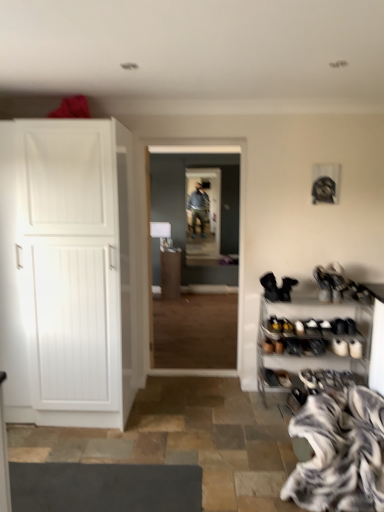
Question: Should I look upward or downward to see white matte cabinet at left?

Choices:
 (A) down
 (B) up

Answer: (A)

Question: From a real-world perspective, is black suede boot at right, the 1th footwear from the right, positioned over wooden floor at center based on gravity?

Choices:
 (A) yes
 (B) no

Answer: (B)

Question: Is black suede boot at right, the second footwear in the left-to-right sequence, smaller than wooden floor at center?

Choices:
 (A) yes
 (B) no

Answer: (A)

Question: Is black suede boot at right, the second footwear in the left-to-right sequence, oriented towards wooden floor at center?

Choices:
 (A) yes
 (B) no

Answer: (B)

Question: Does black suede boot at right, the 1th footwear from the right, come in front of wooden floor at center?

Choices:
 (A) no
 (B) yes

Answer: (B)

Question: Can you confirm if black suede boot at right, the second footwear in the left-to-right sequence, is positioned to the right of wooden floor at center?

Choices:
 (A) no
 (B) yes

Answer: (B)

Question: Is black suede boot at right, the second footwear in the left-to-right sequence, bigger than wooden floor at center?

Choices:
 (A) yes
 (B) no

Answer: (B)

Question: Is white matte cabinet at left located outside black suede boot at lower right, the 1th footwear from the left?

Choices:
 (A) yes
 (B) no

Answer: (A)

Question: Are white matte cabinet at left and black suede boot at lower right, acting as the 2th footwear starting from the right, located far from each other?

Choices:
 (A) yes
 (B) no

Answer: (A)

Question: Is white matte cabinet at left thinner than black suede boot at lower right, acting as the 2th footwear starting from the right?

Choices:
 (A) yes
 (B) no

Answer: (B)

Question: From the image's perspective, is white matte cabinet at left under black suede boot at lower right, acting as the 2th footwear starting from the right?

Choices:
 (A) no
 (B) yes

Answer: (A)

Question: Is black suede boot at lower right, acting as the 2th footwear starting from the right, surrounded by white matte cabinet at left?

Choices:
 (A) no
 (B) yes

Answer: (A)

Question: Does white matte cabinet at left have a greater width compared to black suede boot at lower right, the 1th footwear from the left?

Choices:
 (A) yes
 (B) no

Answer: (A)

Question: Could zebra print fur at lower right be considered to be inside wooden floor at center?

Choices:
 (A) no
 (B) yes

Answer: (A)